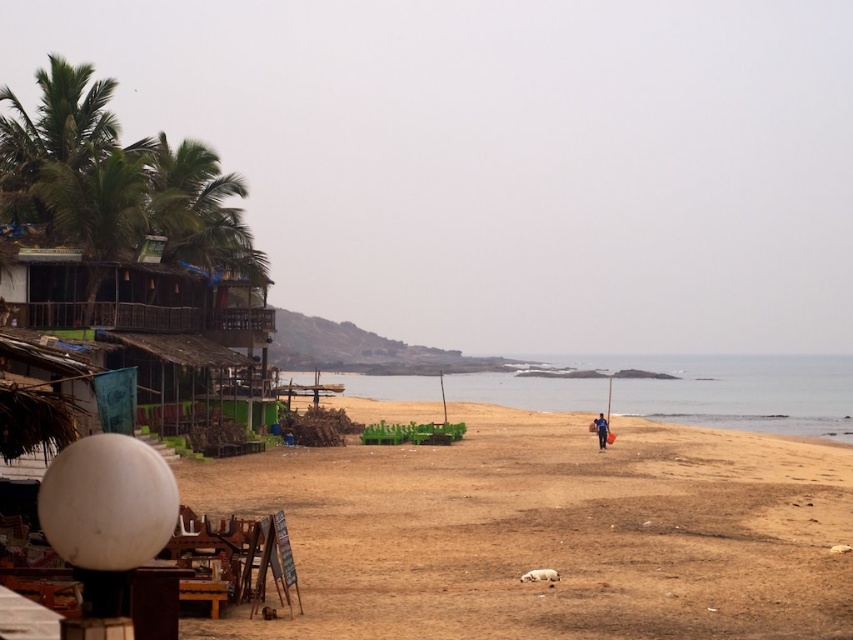
Question: Which of these objects is positioned closest to the wooden hut at left?

Choices:
 (A) blue fabric bag at center
 (B) brown sandy beach at lower center

Answer: (B)

Question: Can you confirm if clear blue water at center is positioned above green leafy palm tree at left?

Choices:
 (A) yes
 (B) no

Answer: (B)

Question: Which point appears farthest from the camera in this image?

Choices:
 (A) [x=596, y=416]
 (B) [x=612, y=605]
 (C) [x=769, y=362]
 (D) [x=175, y=353]

Answer: (C)

Question: Based on their relative distances, which object is nearer to the wooden hut at left?

Choices:
 (A) green leafy palm tree at left
 (B) brown sandy beach at lower center

Answer: (A)

Question: Does brown sandy beach at lower center have a smaller size compared to green leafy palm tree at left?

Choices:
 (A) no
 (B) yes

Answer: (A)

Question: Can you confirm if wooden hut at left is smaller than clear blue water at center?

Choices:
 (A) no
 (B) yes

Answer: (B)